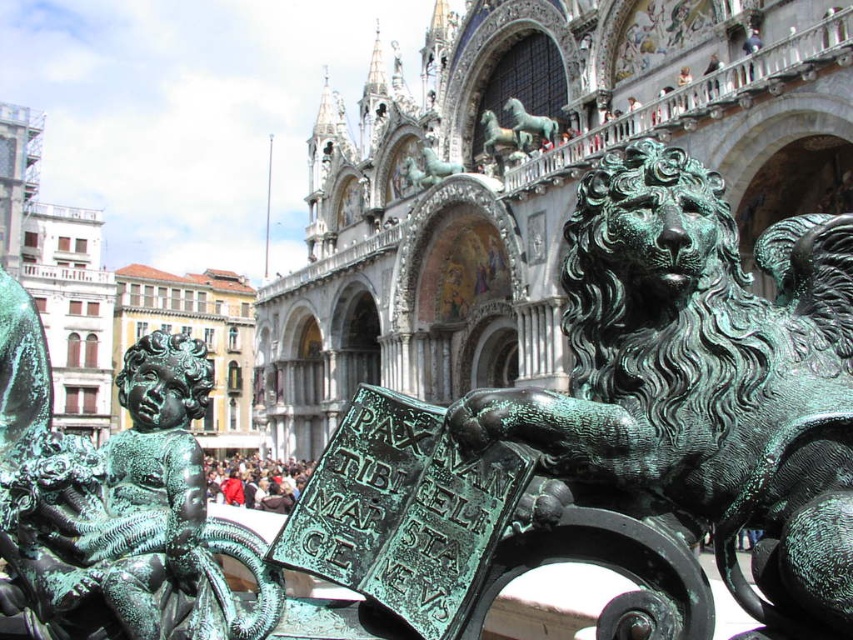
Which of these two, green patina lion at center or green patina cherub at lower left, stands taller?

With more height is green patina lion at center.

Between green patina lion at center and green patina cherub at lower left, which one appears on the right side from the viewer's perspective?

green patina lion at center is more to the right.

Describe the element at coordinates (704, 378) in the screenshot. This screenshot has height=640, width=853. I see `green patina lion at center` at that location.

The height and width of the screenshot is (640, 853). Find the location of `green patina lion at center`. green patina lion at center is located at coordinates (704, 378).